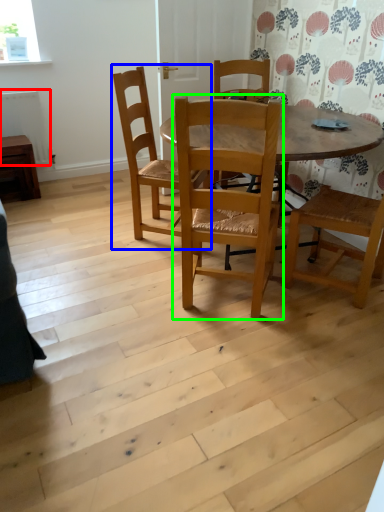
Question: Estimate the real-world distances between objects in this image. Which object is farther from radiator (highlighted by a red box), chair (highlighted by a blue box) or chair (highlighted by a green box)?

Choices:
 (A) chair
 (B) chair

Answer: (B)